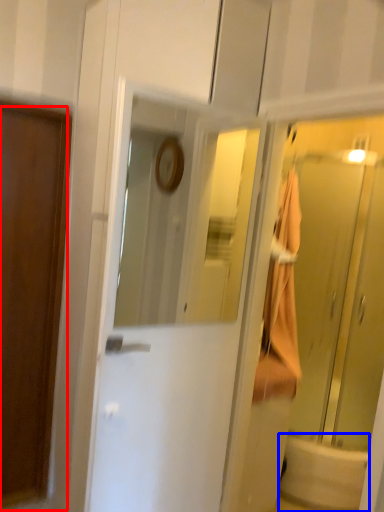
Question: Which of the following is the closest to the observer, door (highlighted by a red box) or bath (highlighted by a blue box)?

Choices:
 (A) door
 (B) bath

Answer: (A)